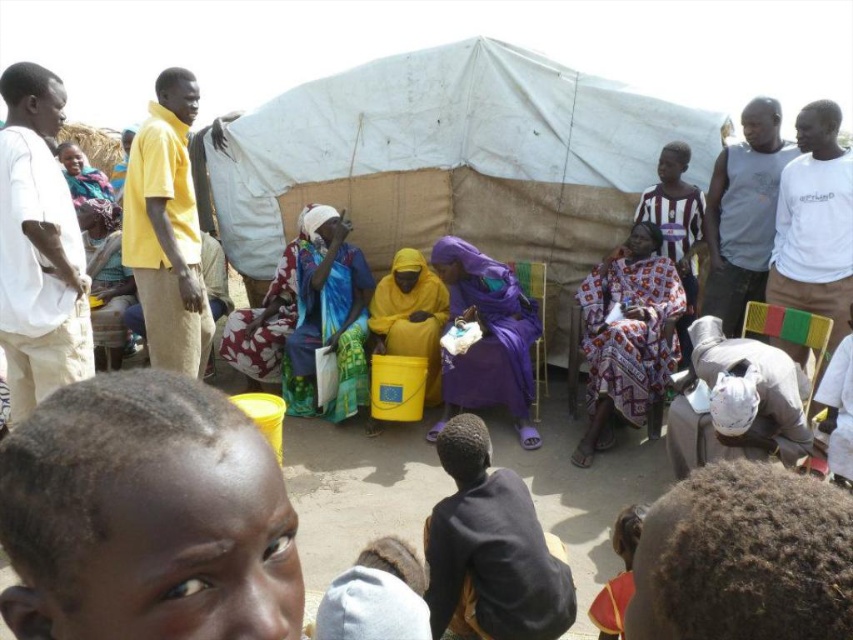
You are standing at the center of the image and see a point marked at coordinates (628, 339). What object is located at that point?

The point at (628, 339) indicates the printed fabric dress at center.

In the scene shown: You are part of a community group setting up a meeting area under the tent. You need to position a new attendee so they can see both the yellow fabric dress at center and the green and yellow striped chair at lower right. Where should you place them?

The new attendee should be positioned to the right of the green and yellow striped chair at lower right so they can see both the yellow fabric dress at center and the chair. Since the yellow fabric dress is to the left of the chair, placing them to the right allows a clear view of both objects.

You are a photographer trying to capture a candid shot of the yellow fabric dress at center and the green and yellow striped chair at lower right. Since you want to ensure both subjects are in focus, you need to know which one is taller. Can you tell me which object is taller?

The yellow fabric dress at center is taller than the green and yellow striped chair at lower right, so you should adjust your camera settings to focus on the taller subject first.